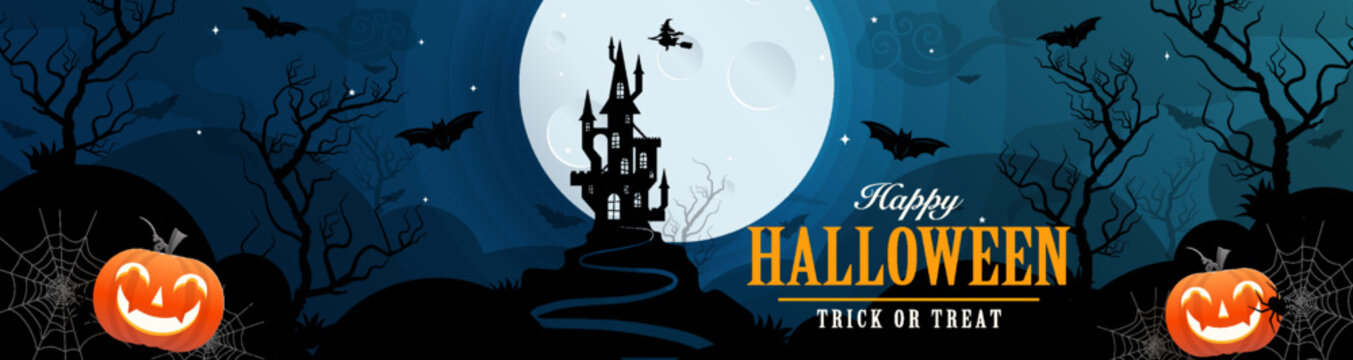
Find the location of `broom`. broom is located at coordinates (683, 42).